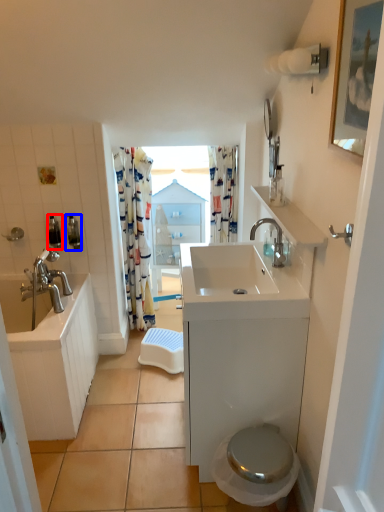
Question: Which point is further to the camera, toiletry (highlighted by a red box) or toiletry (highlighted by a blue box)?

Choices:
 (A) toiletry
 (B) toiletry

Answer: (B)